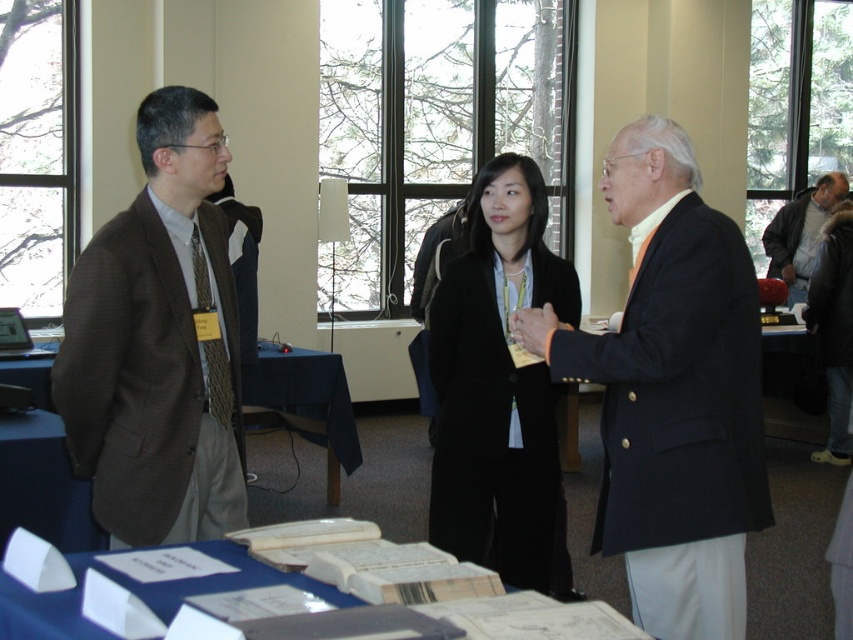
Is orange silk tie at center shorter than gray wool jacket at right?

No, orange silk tie at center is not shorter than gray wool jacket at right.

Between point (636, 516) and point (814, 198), which one is positioned in front?

Positioned in front is point (636, 516).

Locate an element on the screen. Image resolution: width=853 pixels, height=640 pixels. orange silk tie at center is located at coordinates (672, 392).

Locate an element on the screen. This screenshot has height=640, width=853. orange silk tie at center is located at coordinates (672, 392).

Looking at this image, who is shorter, brown textured blazer at left or blue fabric table at center?

blue fabric table at center is shorter.

Can you confirm if brown textured blazer at left is wider than blue fabric table at center?

Incorrect, brown textured blazer at left's width does not surpass blue fabric table at center's.

Is point (212, 305) closer to camera compared to point (247, 387)?

Yes, point (212, 305) is closer to viewer.

Where is `brown textured blazer at left`? Image resolution: width=853 pixels, height=640 pixels. brown textured blazer at left is located at coordinates (158, 342).

Does orange silk tie at center come in front of black matte blazer at center?

Yes, orange silk tie at center is in front of black matte blazer at center.

Who is more forward, (646,342) or (502,202)?

Point (646,342)

Locate an element on the screen. This screenshot has height=640, width=853. orange silk tie at center is located at coordinates (672, 392).